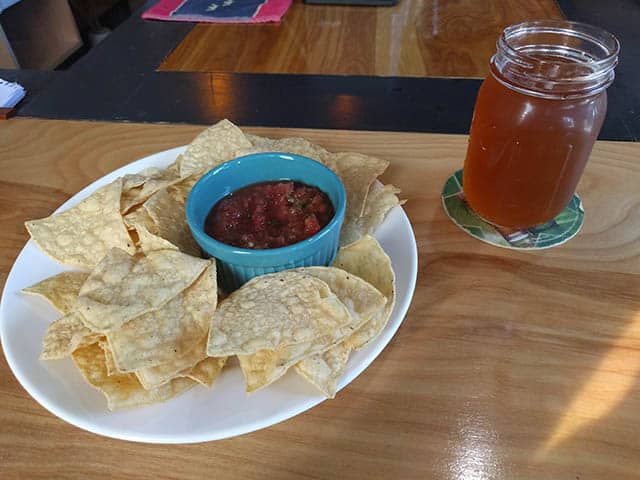
This screenshot has width=640, height=480. I want to click on coaster, so click(518, 241).